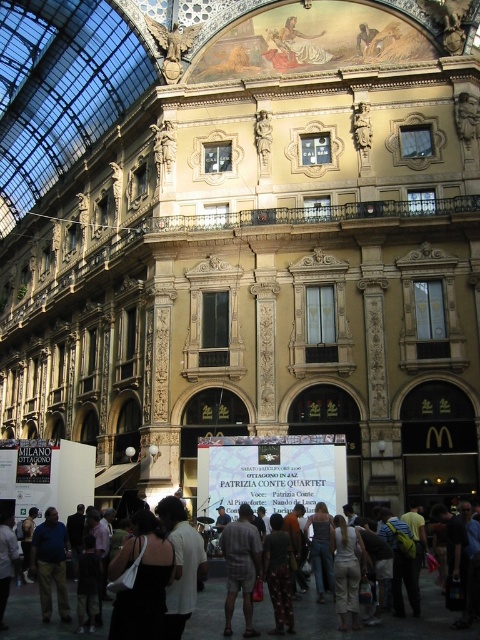
Question: Considering the real-world distances, which object is farthest from the dark gray pants at center?

Choices:
 (A) black fabric dress at lower center
 (B) printed cotton dress at center

Answer: (B)

Question: Is black fabric dress at lower center positioned at the back of dark blue jeans at lower left?

Choices:
 (A) yes
 (B) no

Answer: (B)

Question: Does light brown fabric shorts at center lie behind dark blue jeans at lower left?

Choices:
 (A) yes
 (B) no

Answer: (B)

Question: Estimate the real-world distances between objects in this image. Which object is closer to the printed cotton dress at center?

Choices:
 (A) dark gray pants at center
 (B) dark blue jeans at lower left

Answer: (A)

Question: Which object appears closest to the camera in this image?

Choices:
 (A) printed cotton dress at center
 (B) white cotton shirt at center
 (C) black fabric dress at lower center
 (D) light brown fabric shorts at center

Answer: (C)

Question: Is white cotton shirt at center below light brown fabric shorts at center?

Choices:
 (A) no
 (B) yes

Answer: (A)